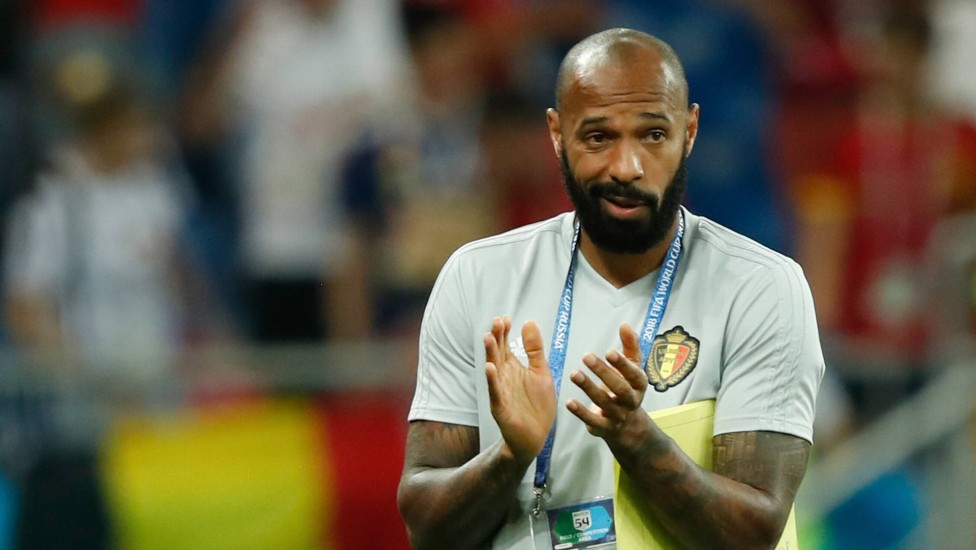
Find the location of a particular element. lantern is located at coordinates (554, 323).